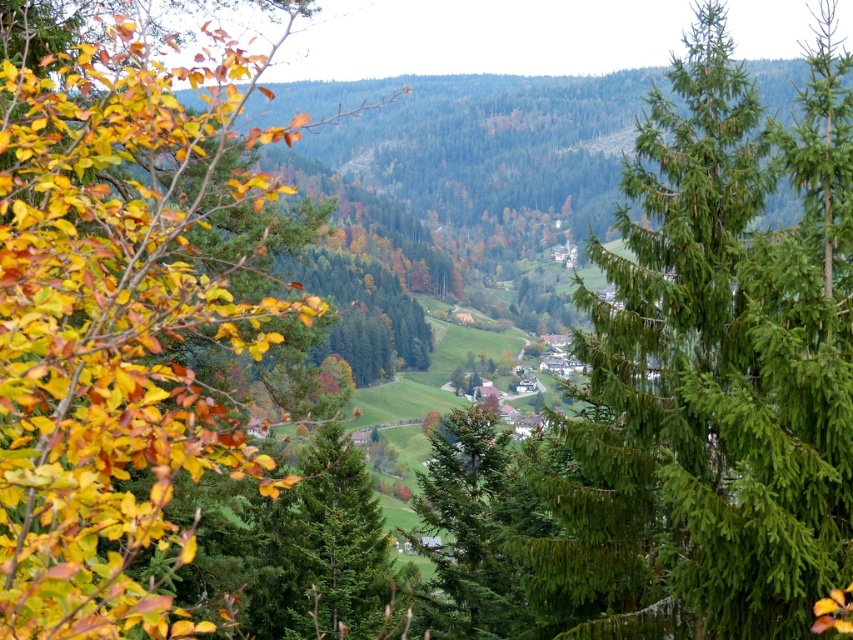
Question: Which of the following is the closest to the observer?

Choices:
 (A) (9, 262)
 (B) (645, 170)

Answer: (A)

Question: In this image, where is green needle-like at center located relative to yellow-green leaves at left?

Choices:
 (A) right
 (B) left

Answer: (A)

Question: Which object is farther from the camera taking this photo?

Choices:
 (A) green needle-like at center
 (B) yellow-green leaves at left

Answer: (A)

Question: Does green needle-like at center come behind yellow-green leaves at left?

Choices:
 (A) no
 (B) yes

Answer: (B)

Question: Can you confirm if green needle-like at center is bigger than yellow-green leaves at left?

Choices:
 (A) yes
 (B) no

Answer: (A)